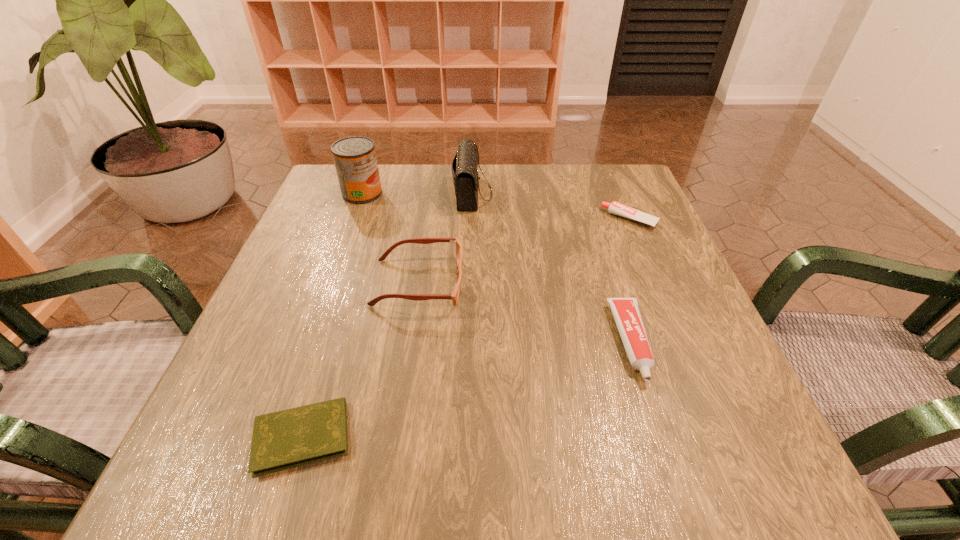
The height and width of the screenshot is (540, 960). Identify the location of blank space located 0.170m on the front flap of the fifth shortest object. (561, 193).

This screenshot has width=960, height=540. In order to click on free spot located on the front-facing side of the spectacles in this screenshot , I will do `click(659, 283)`.

Find the location of a particular element. This screenshot has height=540, width=960. vacant area located 0.080m at the nozzle of the taller toothpaste is located at coordinates (660, 434).

I want to click on free location located 0.220m on the left of the shorter toothpaste, so click(508, 219).

This screenshot has height=540, width=960. What are the coordinates of `vacant region located 0.260m on the right of the shortest object` in the screenshot? It's located at (536, 437).

The height and width of the screenshot is (540, 960). I want to click on can that is at the far edge, so 355,160.

Identify the location of clutch bag that is at the far edge. The height and width of the screenshot is (540, 960). [x=464, y=166].

Locate an element on the screen. This screenshot has width=960, height=540. toothpaste that is at the far edge is located at coordinates (616, 208).

Where is `object that is at the near edge`? object that is at the near edge is located at coordinates (286, 439).

The height and width of the screenshot is (540, 960). Identify the location of can that is at the left edge. (355, 160).